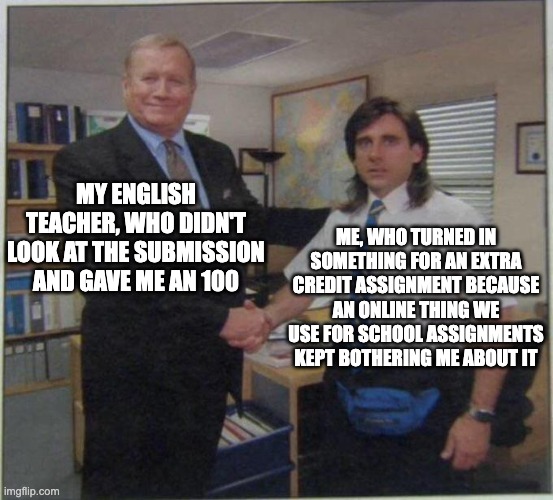
What are the coordinates of `gray floor` in the screenshot? It's located at (28, 414).